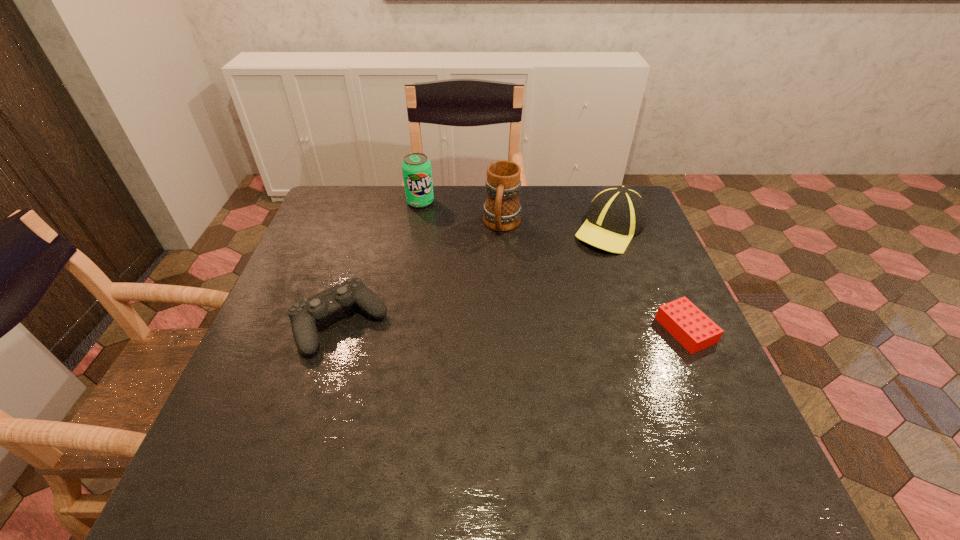
Locate an element on the screen. The height and width of the screenshot is (540, 960). vacant space in between the second shortest object and the Lego is located at coordinates (513, 326).

The image size is (960, 540). Identify the location of vacant area that lies between the fourth shortest object and the fourth tallest object. (380, 262).

What are the coordinates of `free spot between the mug and the Lego` in the screenshot? It's located at coord(593,278).

I want to click on free point between the third tallest object and the shortest object, so click(x=648, y=279).

Locate an element on the screen. The height and width of the screenshot is (540, 960). vacant area between the fourth shortest object and the Lego is located at coordinates (553, 266).

Image resolution: width=960 pixels, height=540 pixels. Find the location of `free area in between the Lego and the mug`. free area in between the Lego and the mug is located at coordinates (593, 278).

Where is `the second closest object to the baseball cap`? the second closest object to the baseball cap is located at coordinates (695, 331).

Find the location of a particular element. The width and height of the screenshot is (960, 540). object identified as the closest to the pop soda is located at coordinates (502, 211).

Find the location of a particular element. The image size is (960, 540). free space that satisfies the following two spatial constraints: 1. on the front side of the control; 2. on the right side of the Lego is located at coordinates (338, 330).

What are the coordinates of `free spot that satisfies the following two spatial constraints: 1. on the front side of the shortest object; 2. on the left side of the control` in the screenshot? It's located at (338, 330).